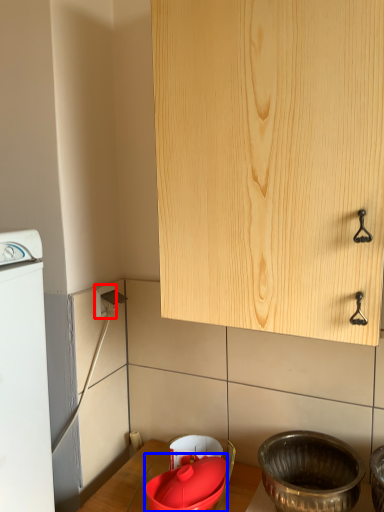
Question: Which object appears closest to the camera in this image, electric outlet (highlighted by a red box) or basin (highlighted by a blue box)?

Choices:
 (A) electric outlet
 (B) basin

Answer: (B)